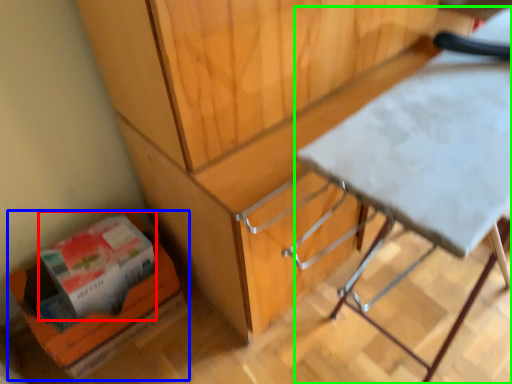
Question: Considering the real-world distances, which object is closest to box (highlighted by a red box)? cardboard box (highlighted by a blue box) or table (highlighted by a green box).

Choices:
 (A) cardboard box
 (B) table

Answer: (A)